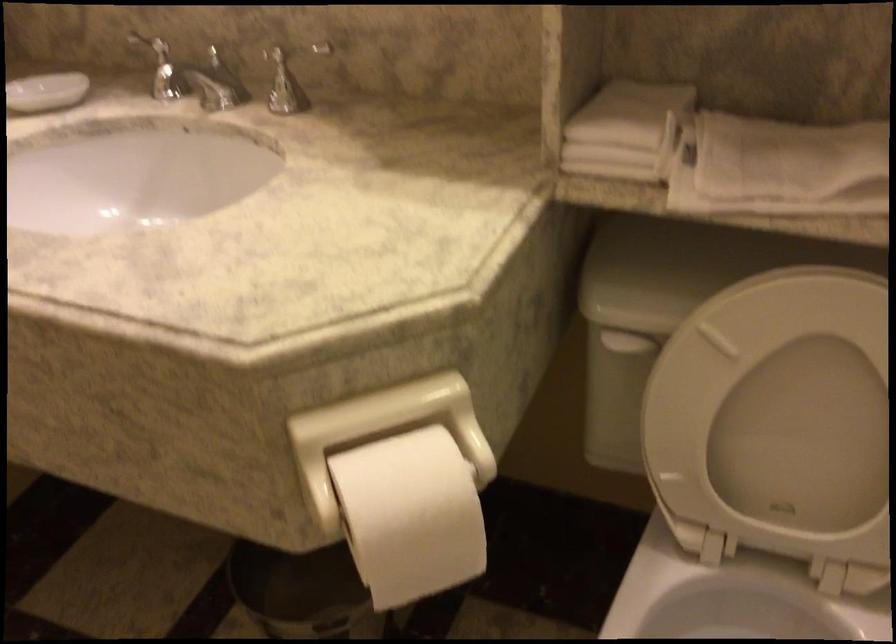
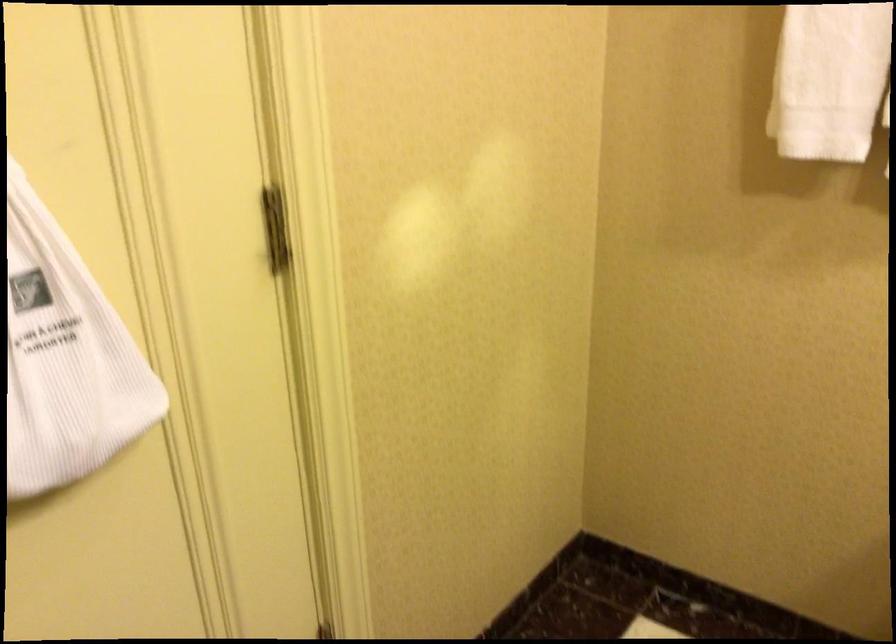
The images are taken continuously from a first-person perspective. In which direction is your viewpoint rotating?

The camera rotated toward left-down.